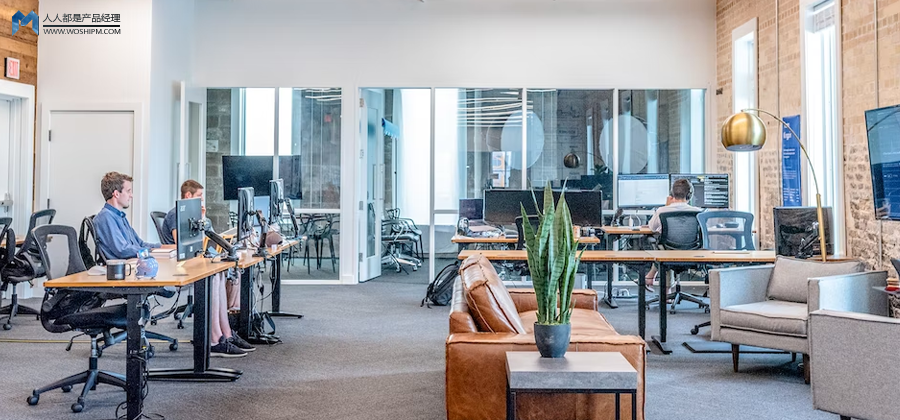
You are a GUI agent. You are given a task and a screenshot of the screen. Output one action in this format:
    pyautogui.click(x=<x>, y=<y>)
    Task: Click on the table leg
    
    Given the screenshot: What is the action you would take?
    click(x=136, y=376), click(x=199, y=351), click(x=209, y=342), click(x=245, y=313), click(x=248, y=310), click(x=276, y=291), click(x=642, y=289), click(x=662, y=300), click(x=609, y=279), click(x=590, y=269)